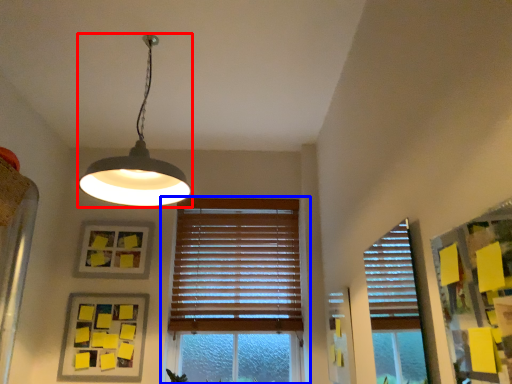
Question: Which object appears closest to the camera in this image, lamp (highlighted by a red box) or window (highlighted by a blue box)?

Choices:
 (A) lamp
 (B) window

Answer: (A)